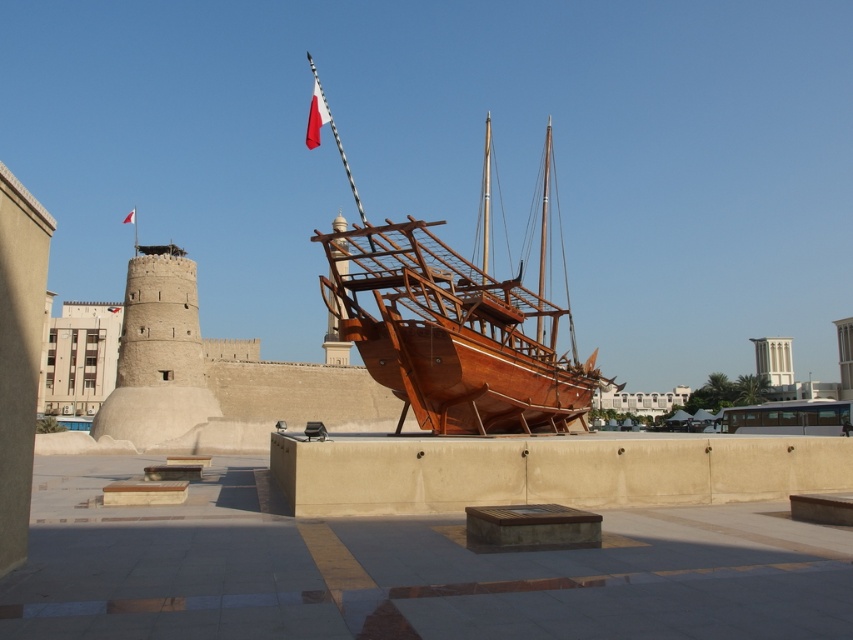
Question: Where is white fabric flag at upper center located in relation to red fabric flag at upper center in the image?

Choices:
 (A) above
 (B) below

Answer: (A)

Question: In this image, where is wooden ship at center located relative to white fabric flag at upper center?

Choices:
 (A) below
 (B) above

Answer: (A)

Question: Which object appears farthest from the camera in this image?

Choices:
 (A) white fabric flag at upper center
 (B) red fabric flag at upper center

Answer: (B)

Question: Estimate the real-world distances between objects in this image. Which object is farther from the white fabric flag at upper center?

Choices:
 (A) red fabric flag at upper center
 (B) wooden ship at center

Answer: (A)

Question: Is wooden ship at center below red fabric flag at upper center?

Choices:
 (A) no
 (B) yes

Answer: (A)

Question: Considering the real-world distances, which object is farthest from the red fabric flag at upper center?

Choices:
 (A) white fabric flag at upper center
 (B) wooden ship at center

Answer: (B)